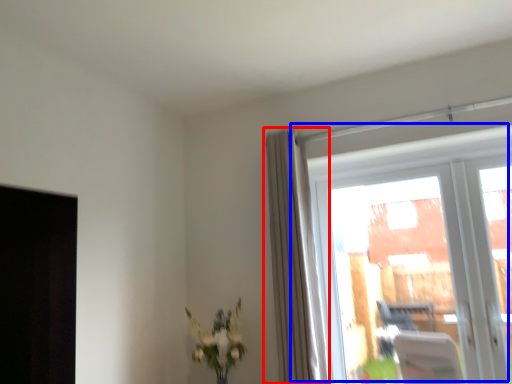
Question: Which point is further to the camera, curtain (highlighted by a red box) or window (highlighted by a blue box)?

Choices:
 (A) curtain
 (B) window

Answer: (A)